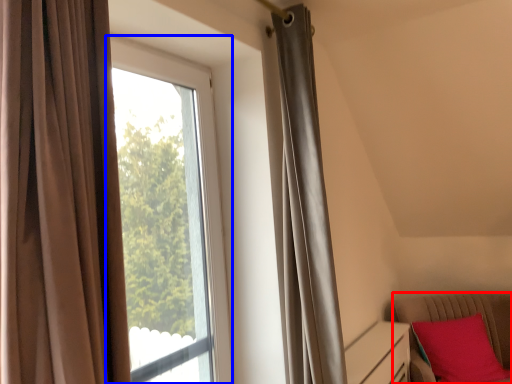
Question: Which object appears farthest to the camera in this image, furniture (highlighted by a red box) or window (highlighted by a blue box)?

Choices:
 (A) furniture
 (B) window

Answer: (A)